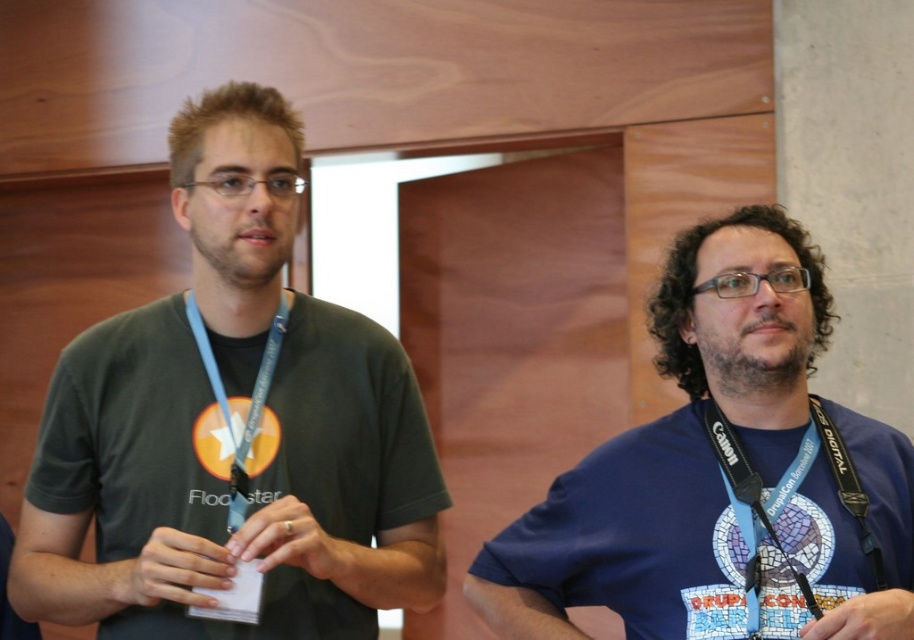
Question: Is blue fabric shirt at right closer to camera compared to blue fabric lanyard at right?

Choices:
 (A) no
 (B) yes

Answer: (B)

Question: Which point is farther to the camera?

Choices:
 (A) matte green neck at center
 (B) dark green t-shirt at left
 (C) blue fabric lanyard at right

Answer: (A)

Question: Is blue fabric shirt at right thinner than blue fabric lanyard at right?

Choices:
 (A) no
 (B) yes

Answer: (A)

Question: Does blue fabric lanyard at right appear under matte green neck at center?

Choices:
 (A) no
 (B) yes

Answer: (B)

Question: Which point is closer to the camera taking this photo?

Choices:
 (A) (802, 513)
 (B) (781, 358)

Answer: (A)

Question: Which point is closer to the camera taking this photo?

Choices:
 (A) (751, 387)
 (B) (177, 148)

Answer: (B)